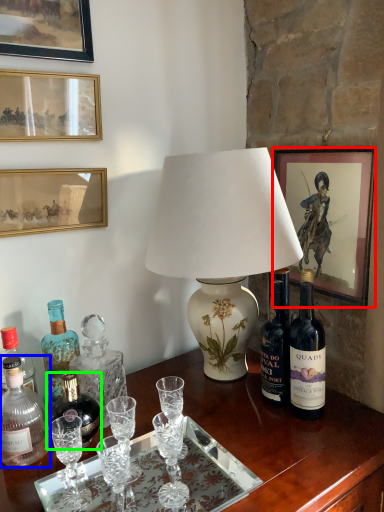
Question: Considering the real-world distances, which object is closest to picture frame (highlighted by a red box)? bottle (highlighted by a blue box) or bottle (highlighted by a green box).

Choices:
 (A) bottle
 (B) bottle

Answer: (B)